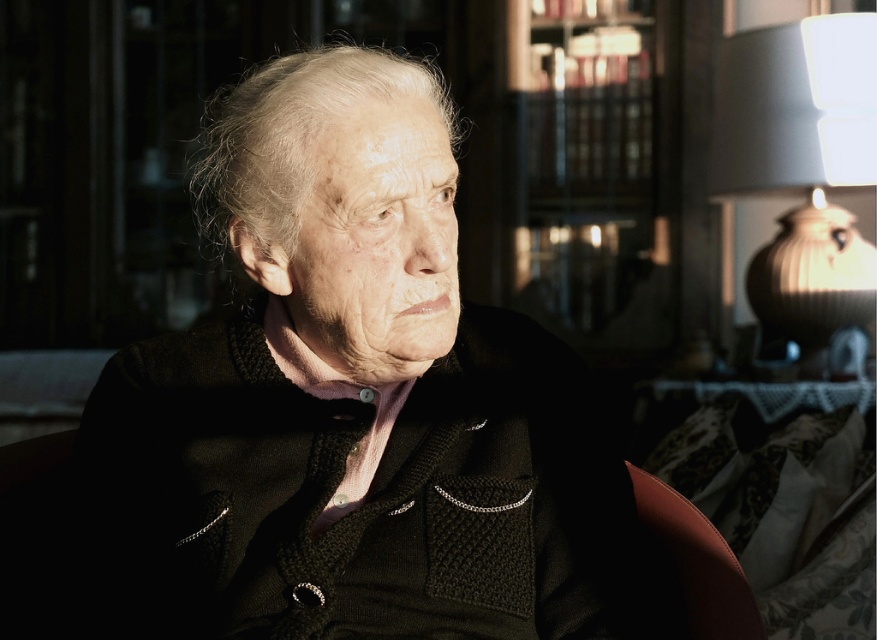
Question: Which object is the farthest from the knitted black sweater at center?

Choices:
 (A) white matte hair at center
 (B) white ceramic lamp at upper right
 (C) leather at right

Answer: (B)

Question: Does knitted black sweater at center have a smaller size compared to leather at right?

Choices:
 (A) no
 (B) yes

Answer: (A)

Question: Does white ceramic lamp at upper right lie behind white matte hair at center?

Choices:
 (A) yes
 (B) no

Answer: (A)

Question: Which point is closer to the camera?

Choices:
 (A) white ceramic lamp at upper right
 (B) knitted black sweater at center
 (C) leather at right
 (D) white matte hair at center

Answer: (B)

Question: Is knitted black sweater at center in front of leather at right?

Choices:
 (A) no
 (B) yes

Answer: (B)

Question: Which point is farther from the camera taking this photo?

Choices:
 (A) (283, 74)
 (B) (861, 38)
 (C) (743, 596)
 (D) (275, 595)

Answer: (B)